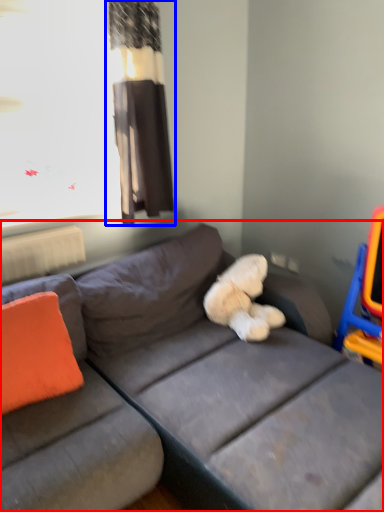
Question: Which object is further to the camera taking this photo, studio couch (highlighted by a red box) or curtain (highlighted by a blue box)?

Choices:
 (A) studio couch
 (B) curtain

Answer: (B)